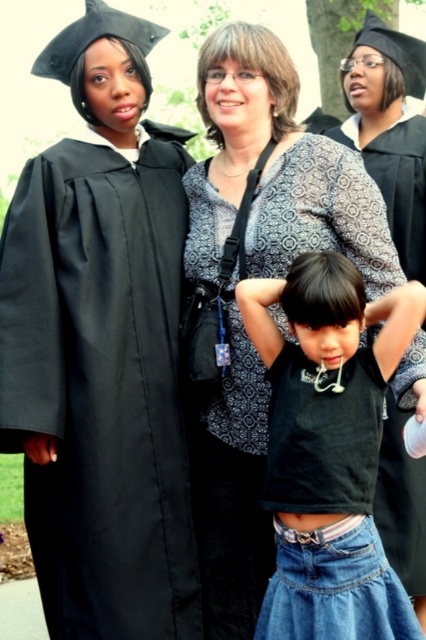
Is point (261, 289) farther from camera compared to point (411, 483)?

No, (261, 289) is in front of (411, 483).

Between black cotton shirt at center and patterned fabric dress at center, which one has more height?

black cotton shirt at center is taller.

This screenshot has width=426, height=640. Find the location of `black cotton shirt at center`. black cotton shirt at center is located at coordinates (328, 449).

Does black matte gown at left appear on the right side of patterned fabric dress at center?

In fact, black matte gown at left is to the left of patterned fabric dress at center.

Between black matte gown at left and patterned fabric dress at center, which one appears on the right side from the viewer's perspective?

From the viewer's perspective, patterned fabric dress at center appears more on the right side.

Who is more forward, (x=143, y=246) or (x=374, y=513)?

Point (x=143, y=246) is more forward.

What are the coordinates of `black matte gown at left` in the screenshot? It's located at (100, 387).

In the scene shown: Can you confirm if black matte gown at left is taller than black cotton shirt at center?

Correct, black matte gown at left is much taller as black cotton shirt at center.

Which is above, black matte gown at left or black cotton shirt at center?

black matte gown at left is above.

Locate an element on the screen. Image resolution: width=426 pixels, height=640 pixels. black matte gown at left is located at coordinates (100, 387).

The height and width of the screenshot is (640, 426). What are the coordinates of `black matte gown at left` in the screenshot? It's located at (100, 387).